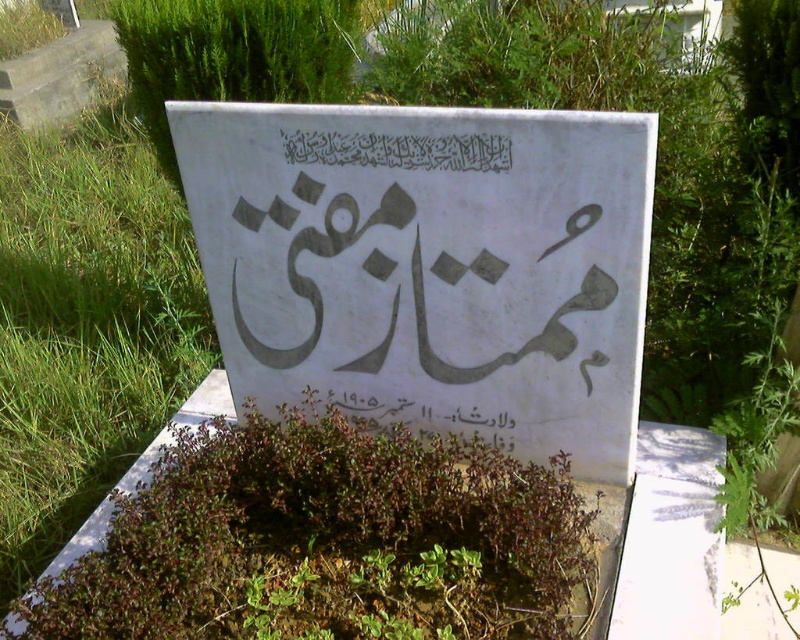
Does green grass at lower left lie in front of black calligraphy at center?

No, it is not.

Is green grass at lower left behind black calligraphy at center?

Yes, green grass at lower left is further from the viewer.

Does point (126, 448) come closer to viewer compared to point (405, 150)?

No, (126, 448) is further to viewer.

Find the location of a particular element. Image resolution: width=800 pixels, height=640 pixels. green grass at lower left is located at coordinates click(x=86, y=323).

Between green leafy plant at center and green grass at lower left, which one appears on the left side from the viewer's perspective?

From the viewer's perspective, green grass at lower left appears more on the left side.

Between point (338, 432) and point (52, 195), which one is positioned behind?

Positioned behind is point (52, 195).

What do you see at coordinates (324, 540) in the screenshot? The image size is (800, 640). I see `green leafy plant at center` at bounding box center [324, 540].

Where is `green leafy plant at center`? The width and height of the screenshot is (800, 640). green leafy plant at center is located at coordinates (324, 540).

Does point (117, 557) lie in front of point (328, 154)?

Yes, point (117, 557) is in front of point (328, 154).

Is green leafy plant at center positioned behind black calligraphy at center?

No, it is in front of black calligraphy at center.

Locate an element on the screen. green leafy plant at center is located at coordinates (324, 540).